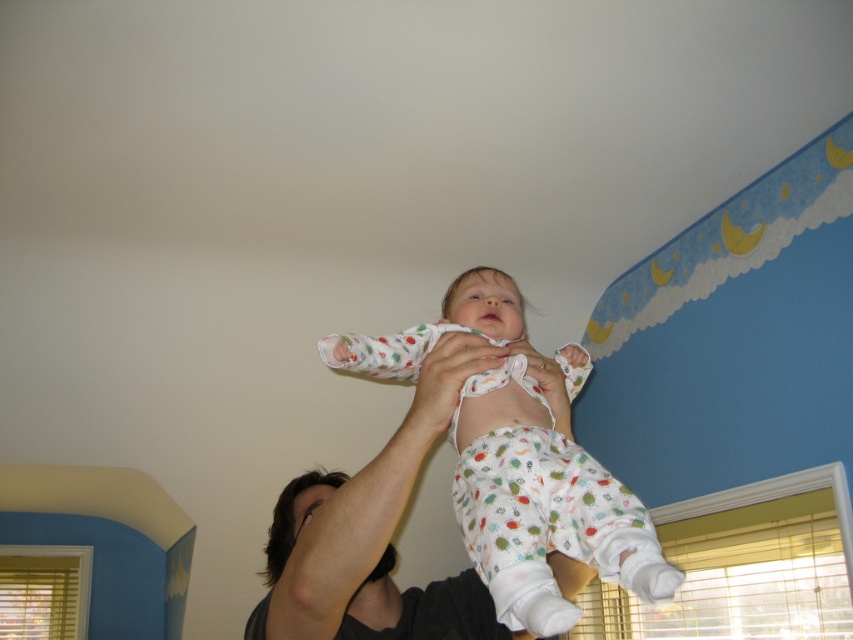
Who is higher up, white cotton onesie at center or smooth skin arm at upper center?

white cotton onesie at center is above.

Based on the photo, does white cotton onesie at center have a greater height compared to smooth skin arm at upper center?

No.

Between point (625, 556) and point (424, 378), which one is positioned in front?

Point (625, 556) is in front.

Locate an element on the screen. white cotton onesie at center is located at coordinates (543, 506).